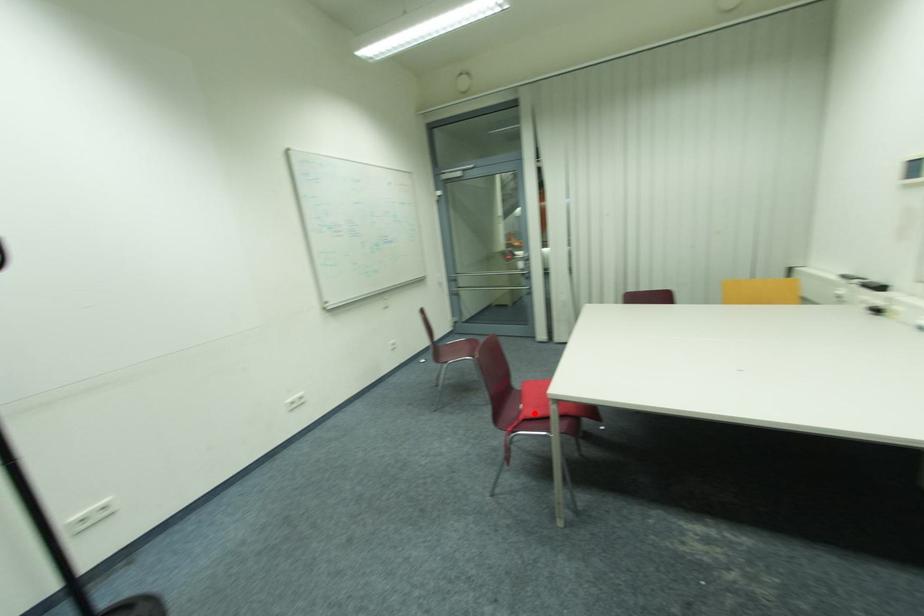
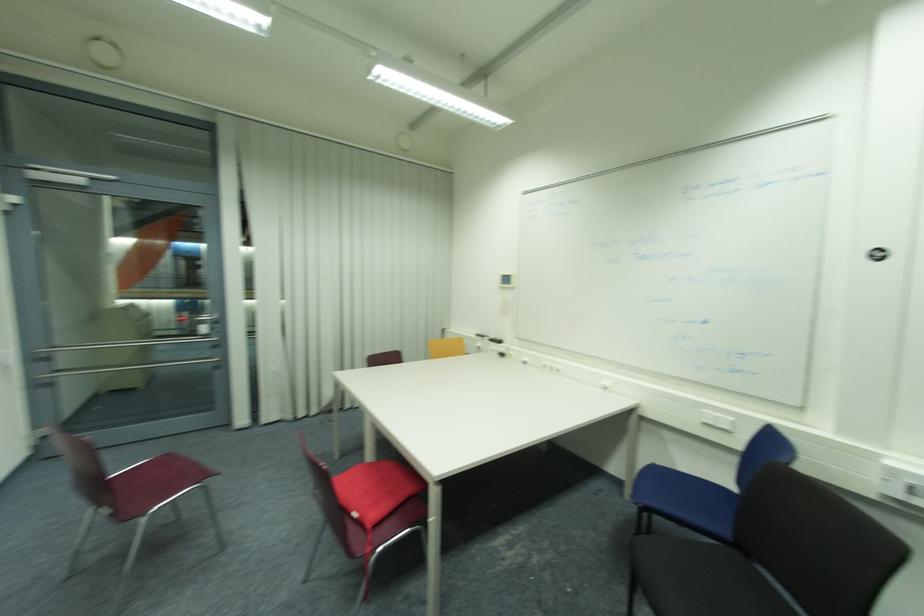
The point at the highlighted location is marked in the first image. Where is the corresponding point in the second image?

(377, 519)